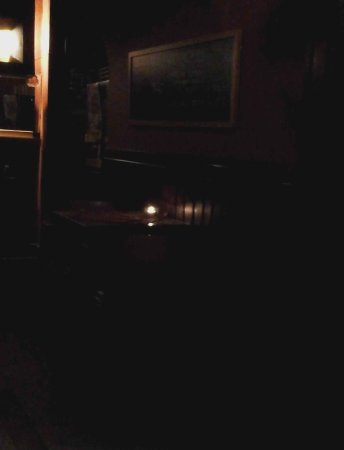
You are a GUI agent. You are given a task and a screenshot of the screen. Output one action in this format:
    pyautogui.click(x=<x>, y=<y>)
    Task: Click on the table
    
    Given the screenshot: What is the action you would take?
    pyautogui.click(x=101, y=222)